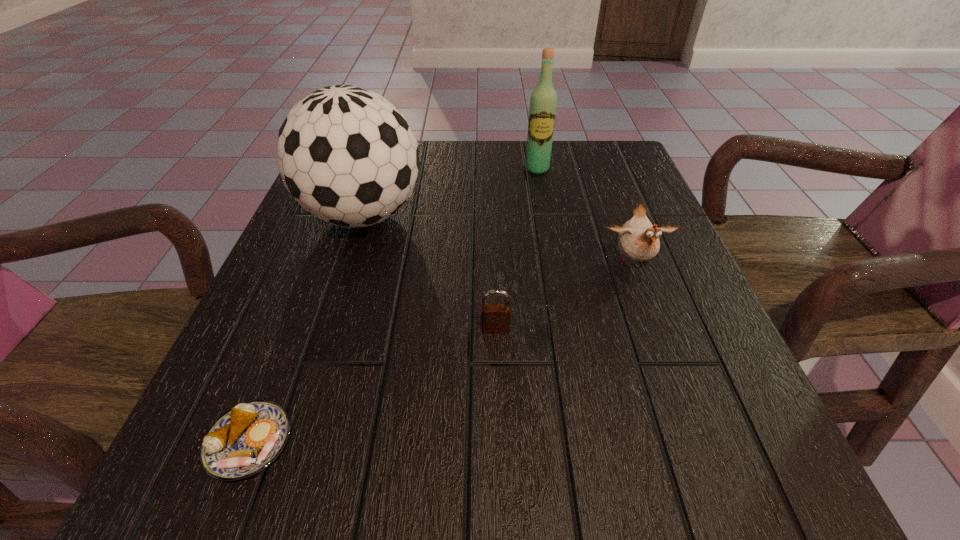
At what (x,y) coordinates should I click in order to perform the action: click on vacant area that lies between the farthest object and the padlock. Please return your answer as a coordinate pair (x, y). Looking at the image, I should click on (516, 249).

The image size is (960, 540). In order to click on unoccupied area between the wine bottle and the third shortest object in this screenshot , I will do `click(585, 216)`.

Locate an element on the screen. Image resolution: width=960 pixels, height=540 pixels. blank region between the fourth farthest object and the soccer ball is located at coordinates (429, 272).

You are a GUI agent. You are given a task and a screenshot of the screen. Output one action in this format:
    pyautogui.click(x=<x>, y=<y>)
    Task: Click on the vacant space in between the third tallest object and the soccer ball
    The height and width of the screenshot is (540, 960).
    Given the screenshot: What is the action you would take?
    pyautogui.click(x=498, y=239)

You are a GUI agent. You are given a task and a screenshot of the screen. Output one action in this format:
    pyautogui.click(x=<x>, y=<y>)
    Task: Click on the empty space between the third object from right to left and the soccer ball
    
    Given the screenshot: What is the action you would take?
    pyautogui.click(x=429, y=272)

This screenshot has height=540, width=960. I want to click on vacant space that's between the padlock and the shortest object, so click(x=372, y=386).

Locate an element on the screen. The image size is (960, 540). free space between the soccer ball and the shortest object is located at coordinates (306, 329).

Point out which object is positioned as the third nearest to the nearest object. Please provide its 2D coordinates. Your answer should be formatted as a tuple, i.e. [(x, y)], where the tuple contains the x and y coordinates of a point satisfying the conditions above.

[(638, 239)]

Identify which object is the third nearest to the second object from right to left. Please provide its 2D coordinates. Your answer should be formatted as a tuple, i.e. [(x, y)], where the tuple contains the x and y coordinates of a point satisfying the conditions above.

[(495, 316)]